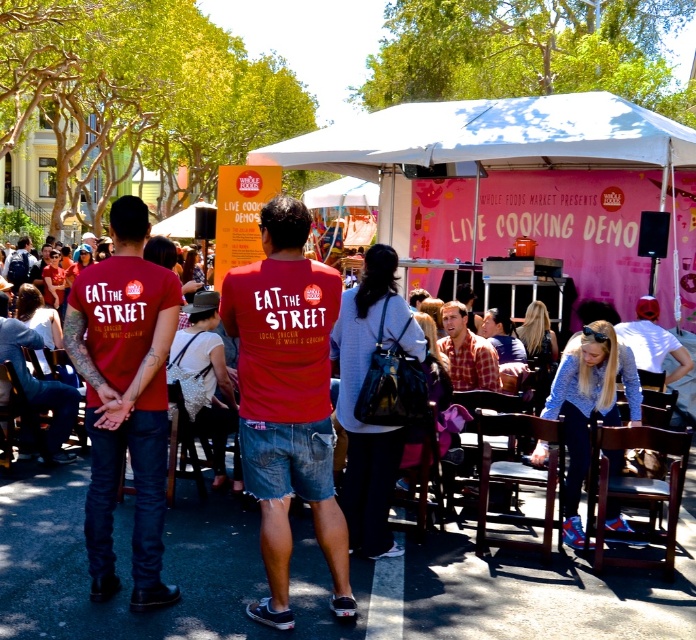
Question: Based on their relative distances, which object is nearer to the matte red t-shirt at left?

Choices:
 (A) white fabric tent at center
 (B) red cotton t-shirt at center

Answer: (B)

Question: Is white fabric tent at center above light blue denim shorts at lower right?

Choices:
 (A) yes
 (B) no

Answer: (A)

Question: Which of these objects is positioned farthest from the red cotton t-shirt at center?

Choices:
 (A) matte red t-shirt at left
 (B) white fabric tent at center
 (C) light blue denim shorts at lower right

Answer: (B)

Question: Can you confirm if red cotton t-shirt at center is thinner than light blue denim shorts at lower right?

Choices:
 (A) no
 (B) yes

Answer: (B)

Question: Which object is farther from the camera taking this photo?

Choices:
 (A) red cotton t-shirt at center
 (B) matte red t-shirt at left
 (C) white fabric tent at center
 (D) light blue denim shorts at lower right

Answer: (C)

Question: Does red cotton t-shirt at center appear over light blue denim shorts at lower right?

Choices:
 (A) yes
 (B) no

Answer: (B)